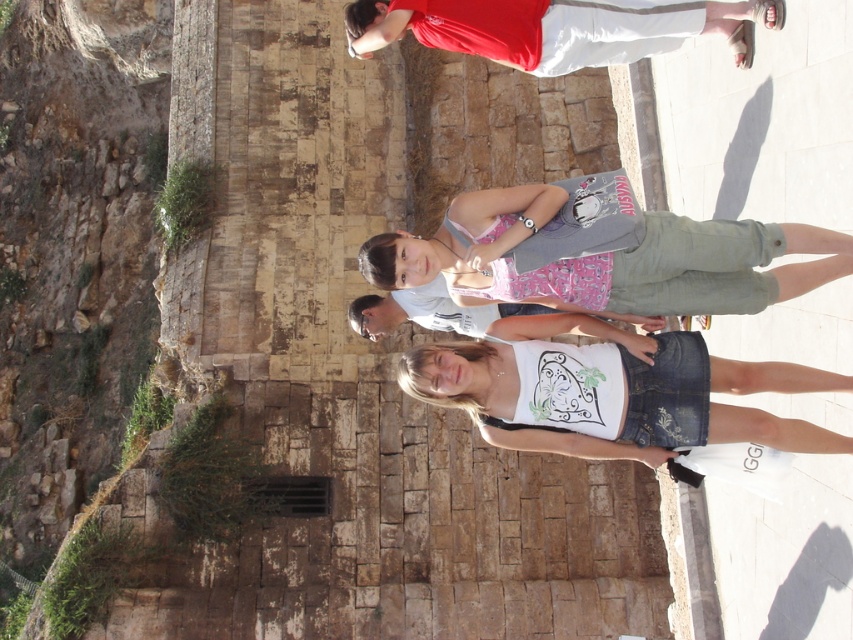
Question: Estimate the real-world distances between objects in this image. Which object is farther from the matte pink tank top at center?

Choices:
 (A) red cotton shirt at upper center
 (B) white cotton shirt at center

Answer: (A)

Question: Which point appears closest to the camera in this image?

Choices:
 (A) (453, 316)
 (B) (483, 403)

Answer: (B)

Question: Which of the following is the farthest from the observer?

Choices:
 (A) (577, 384)
 (B) (665, 4)
 (C) (509, 305)
 (D) (546, 186)

Answer: (C)

Question: Is white cotton tank top at center above matte pink tank top at center?

Choices:
 (A) no
 (B) yes

Answer: (A)

Question: Is red cotton shirt at upper center behind white cotton shirt at center?

Choices:
 (A) yes
 (B) no

Answer: (B)

Question: Is white cotton tank top at center to the left of red cotton shirt at upper center from the viewer's perspective?

Choices:
 (A) yes
 (B) no

Answer: (B)